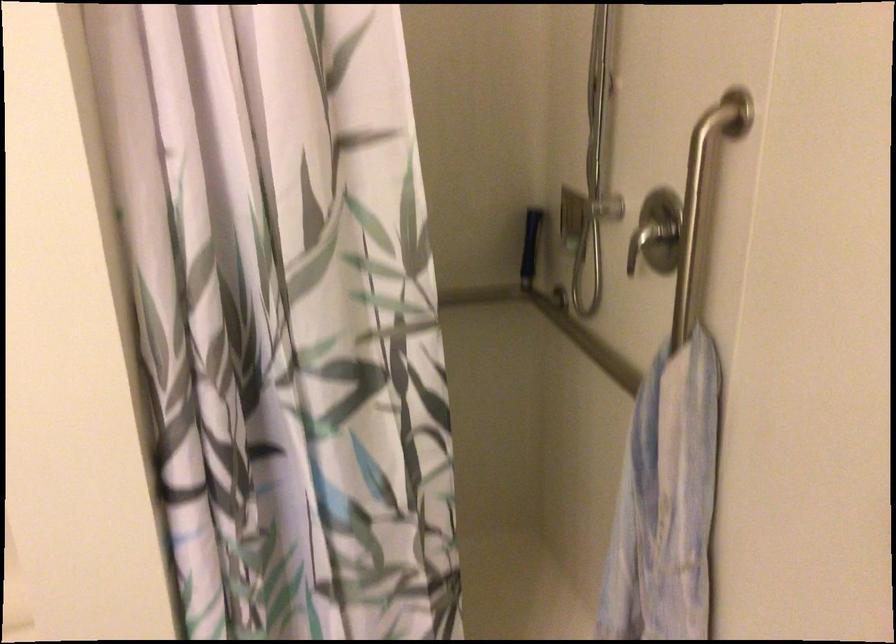
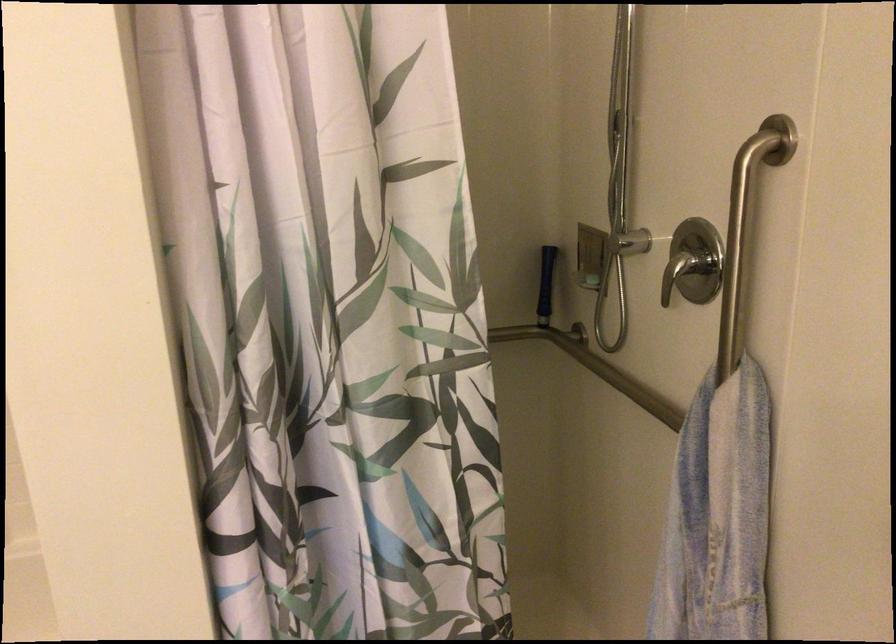
In the second image, find the point that corresponds to (x=690, y=223) in the first image.

(737, 245)